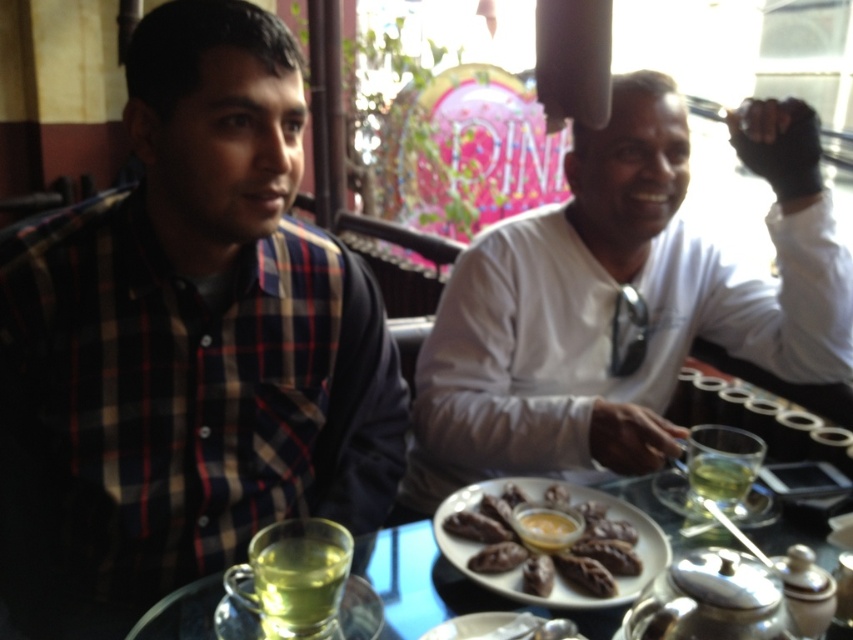
Question: Does green glass cup at lower left appear on the right side of green glass at center?

Choices:
 (A) no
 (B) yes

Answer: (A)

Question: Estimate the real-world distances between objects in this image. Which object is farther from the clear glass plate at center?

Choices:
 (A) brown matte pastry at center
 (B) plaid shirt at left
 (C) green glass at center
 (D) white matte shirt at upper right

Answer: (D)

Question: Which point is farther from the camera taking this photo?

Choices:
 (A) (178, 602)
 (B) (743, 476)
 (C) (277, 577)
 (D) (55, 608)

Answer: (D)

Question: Does green glass cup at lower left appear on the right side of green glass at center?

Choices:
 (A) no
 (B) yes

Answer: (A)

Question: Which point is closer to the camera?

Choices:
 (A) (68, 248)
 (B) (260, 582)
 (C) (360, 557)

Answer: (B)

Question: Is white matte shirt at upper right below green glass at center?

Choices:
 (A) no
 (B) yes

Answer: (A)